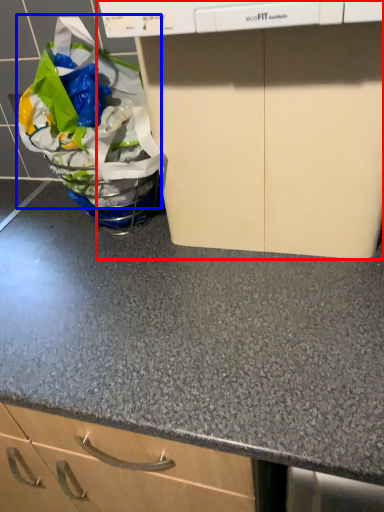
Question: Which of the following is the farthest to the observer, home appliance (highlighted by a red box) or grocery bag (highlighted by a blue box)?

Choices:
 (A) home appliance
 (B) grocery bag

Answer: (B)